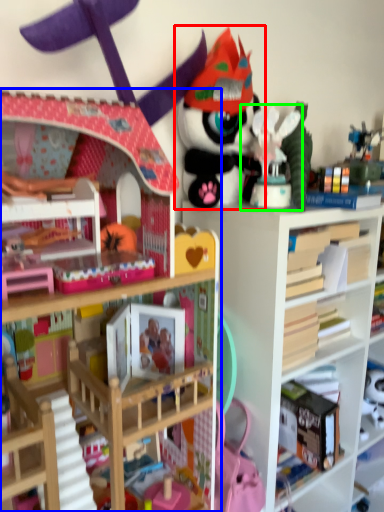
Question: Which is nearer to the toy (highlighted by a red box)? bookcase (highlighted by a blue box) or toy (highlighted by a green box).

Choices:
 (A) bookcase
 (B) toy

Answer: (B)